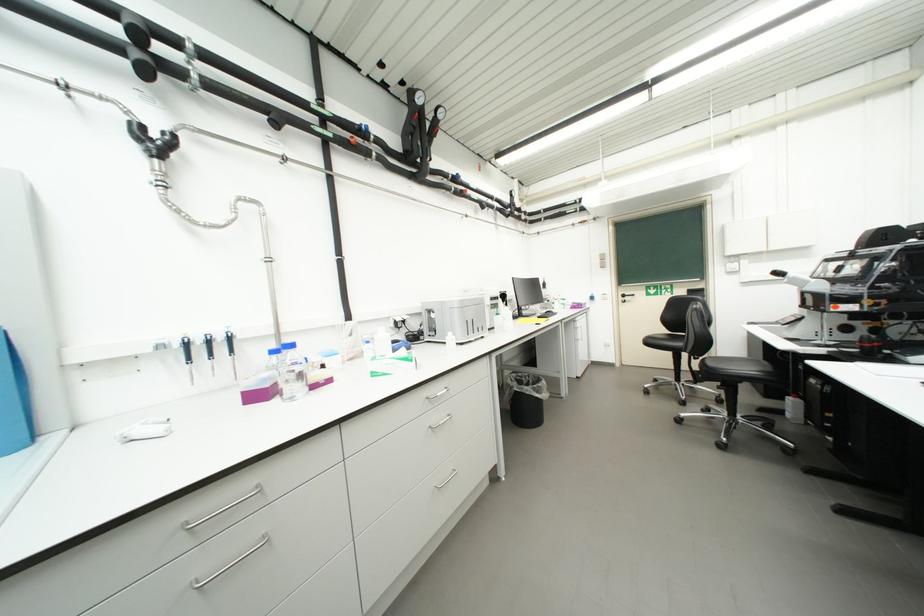
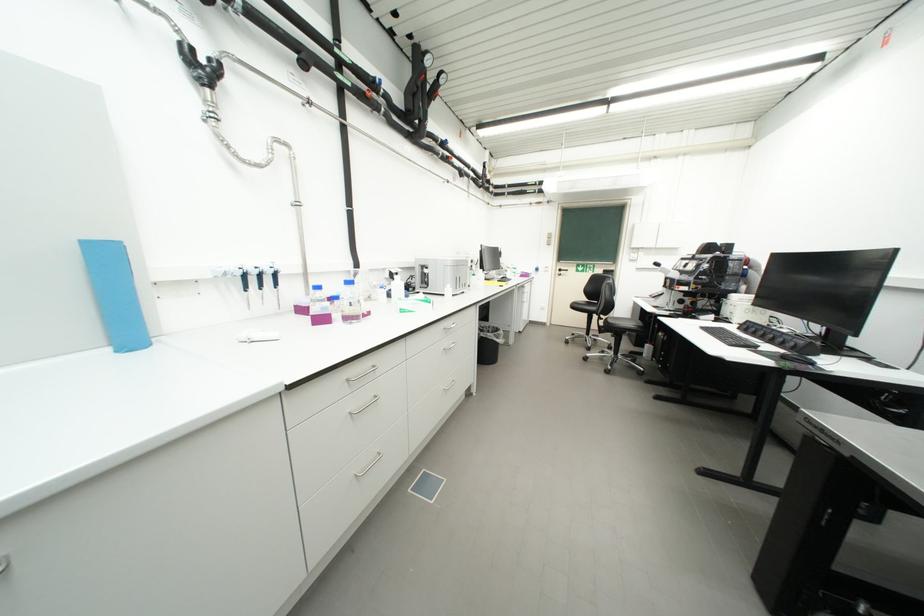
In the second image, find the point that corresponds to point (195, 525) in the first image.

(356, 381)